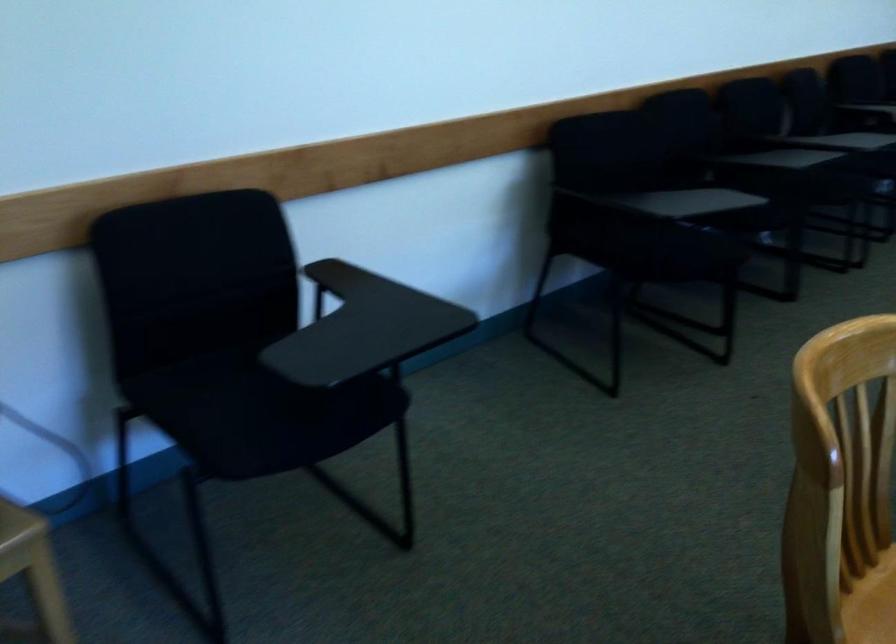
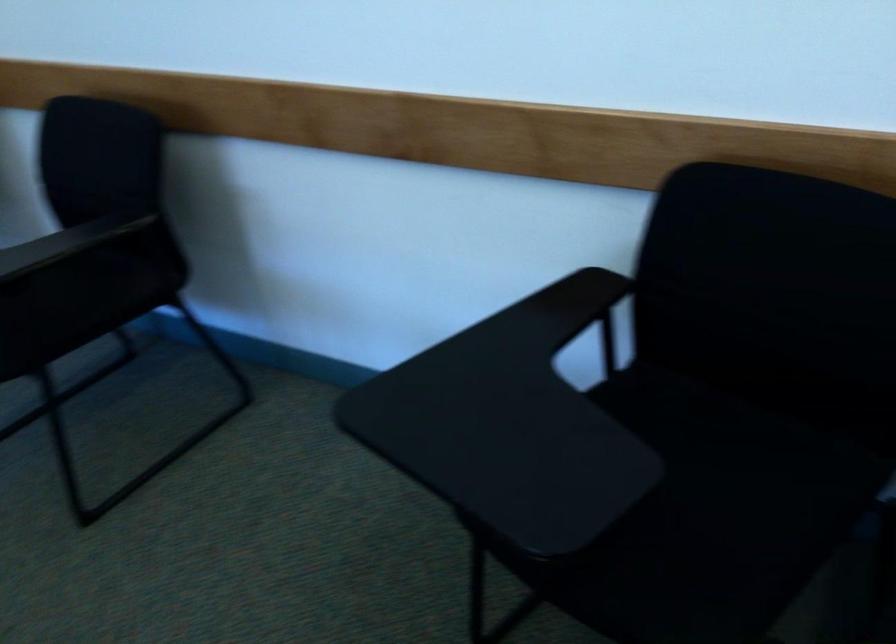
Find the pixel in the second image that matches (x=648, y=222) in the first image.

(743, 457)